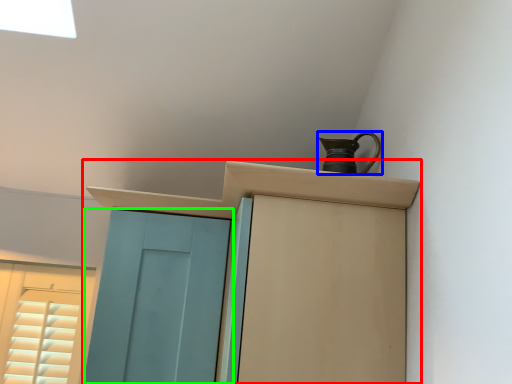
Question: Considering the real-world distances, which object is closest to cupboard (highlighted by a red box)? jug (highlighted by a blue box) or door (highlighted by a green box).

Choices:
 (A) jug
 (B) door

Answer: (A)